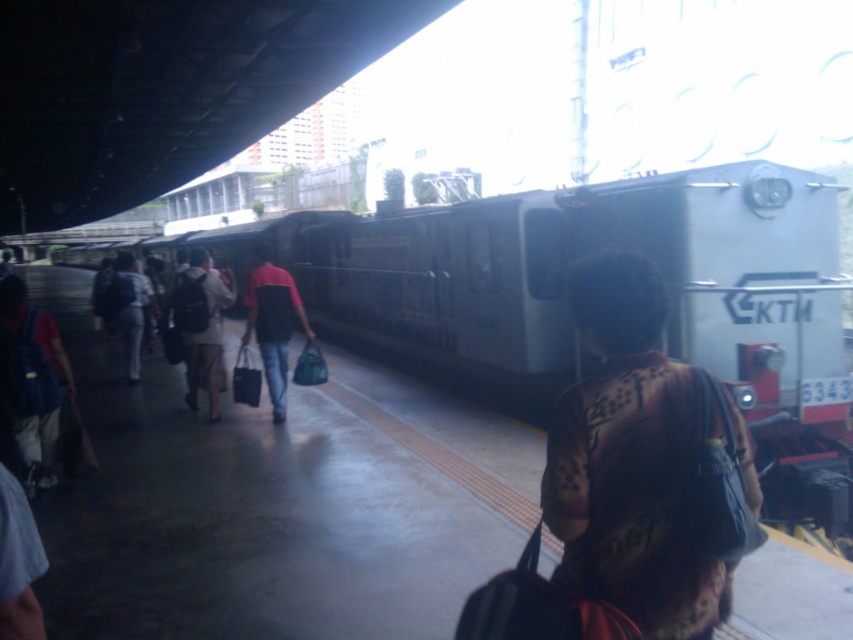
Who is more distant from viewer, (595, 452) or (279, 403)?

A: Positioned behind is point (279, 403).

Is point (729, 484) more distant than point (254, 323)?

No.

Where is `printed fabric shirt at center`? The height and width of the screenshot is (640, 853). printed fabric shirt at center is located at coordinates (646, 465).

Can you confirm if light brown backpack at center is positioned above dark red shirt at center?

Correct, light brown backpack at center is located above dark red shirt at center.

Which is more to the right, light brown backpack at center or dark red shirt at center?

From the viewer's perspective, dark red shirt at center appears more on the right side.

Describe the element at coordinates (200, 326) in the screenshot. Image resolution: width=853 pixels, height=640 pixels. I see `light brown backpack at center` at that location.

Find the location of a particular element. The width and height of the screenshot is (853, 640). light brown backpack at center is located at coordinates (200, 326).

This screenshot has width=853, height=640. What do you see at coordinates (646, 465) in the screenshot?
I see `printed fabric shirt at center` at bounding box center [646, 465].

Find the location of a particular element. This screenshot has width=853, height=640. printed fabric shirt at center is located at coordinates (646, 465).

Where is `printed fabric shirt at center`? The width and height of the screenshot is (853, 640). printed fabric shirt at center is located at coordinates (646, 465).